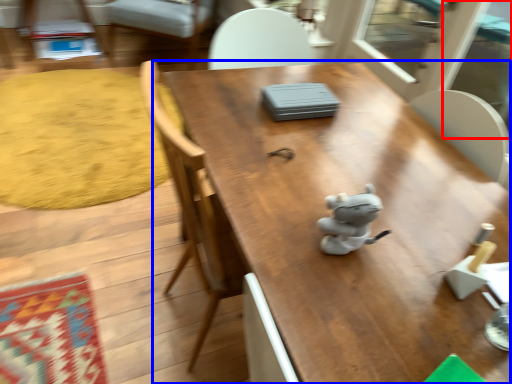
Question: Which point is further to the camera, screen door (highlighted by a red box) or table (highlighted by a blue box)?

Choices:
 (A) screen door
 (B) table

Answer: (A)